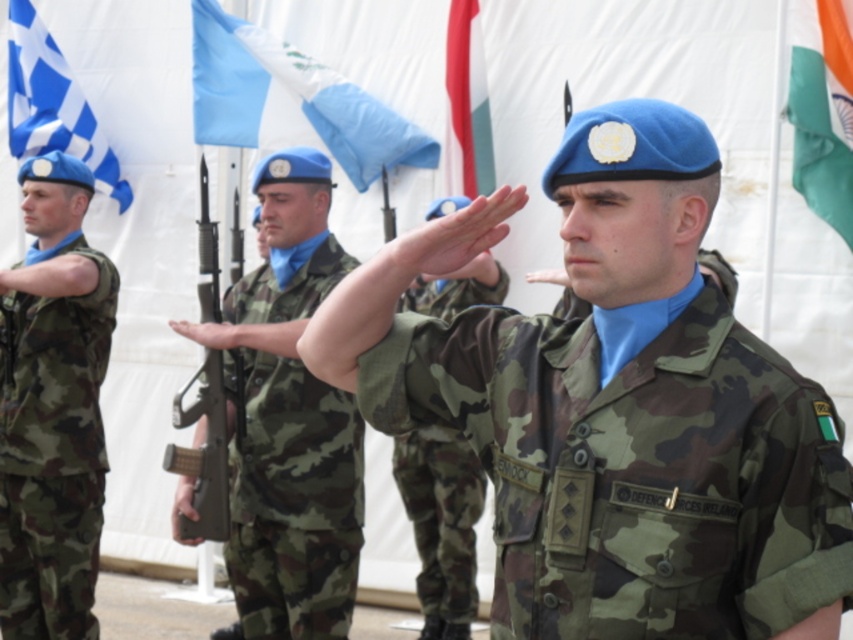
You are a photographer at the military event. You need to capture a photo that includes both the blue fabric flag at upper center and the blue checkered flag at upper left. Based on their positions, which flag should you ensure is placed higher in the frame to include both in the shot?

The blue checkered flag at upper left should be placed higher in the frame because the blue fabric flag at upper center is located below it, so positioning the checkered flag higher allows both to be included.

You are a photographer at the event and want to capture both the camo fabric uniform at left and the blue checkered flag at upper left in the same frame. Which object should you focus on first to ensure both are in the frame?

You should focus on the blue checkered flag at upper left first because it is larger than the camo fabric uniform at left, so centering it first will give more flexibility to include the smaller uniform in the frame.